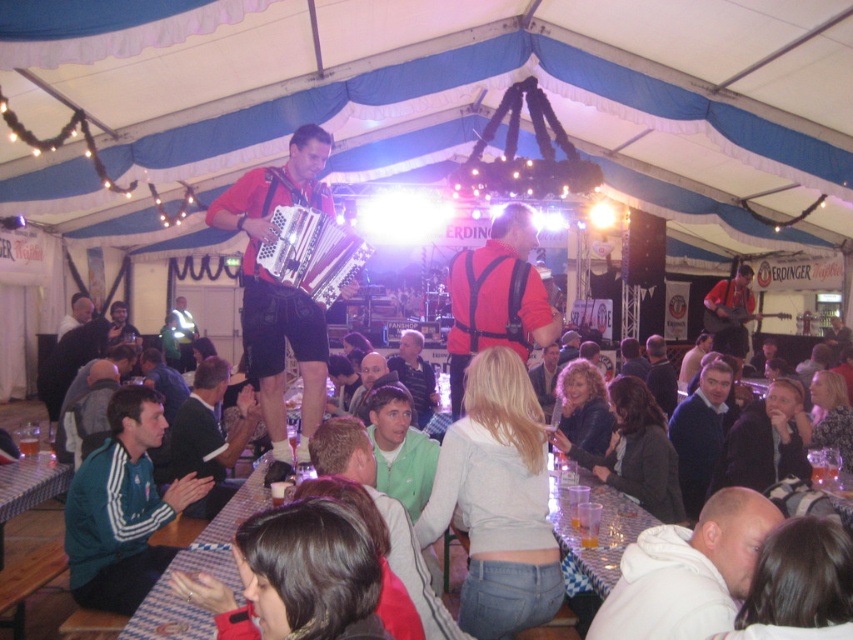
You are a photographer at the event and want to take a photo of both the matte red accordion at center and the matte red shirt at center. From the audience perspective, which object should you focus on first to capture both in the frame?

The matte red accordion at center is to the left of the matte red shirt at center. So, to capture both in the frame from the audience perspective, you should focus on the matte red shirt at center first since it is on the right side and the accordion is to its left, ensuring both are included in the shot.

You are a photographer positioned at the front of the stage. You need to capture a clear photo of both the green fabric jacket at center and the dark blue shirt at center. Which one will appear closer to the top of the photo?

The green fabric jacket at center will appear closer to the top of the photo because it is located above the dark blue shirt at center.